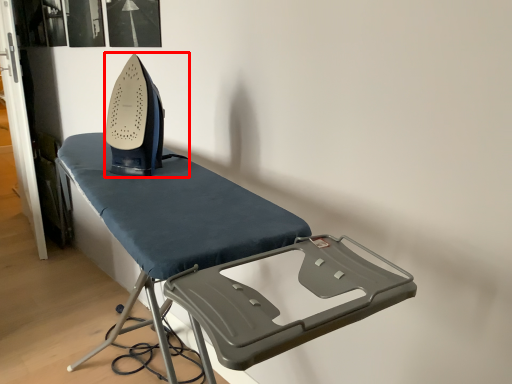
Question: Considering the relative positions of equipment (annotated by the red box) and furniture in the image provided, where is equipment (annotated by the red box) located with respect to the staircase?

Choices:
 (A) left
 (B) right

Answer: (A)